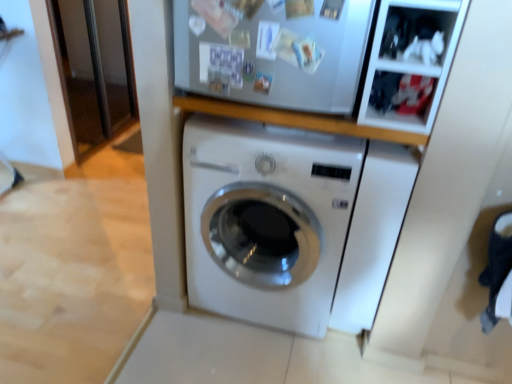
The width and height of the screenshot is (512, 384). What do you see at coordinates (373, 233) in the screenshot? I see `white glossy washing machine at center, which appears as the first washing machine when viewed from the right` at bounding box center [373, 233].

The height and width of the screenshot is (384, 512). In order to click on white glossy washing machine at center, which appears as the first washing machine when viewed from the right in this screenshot , I will do `click(373, 233)`.

Describe the element at coordinates (266, 220) in the screenshot. I see `white glossy washing machine at center, the 2th washing machine positioned from the right` at that location.

In order to face white glossy washing machine at center, which appears as the first washing machine when viewed from the left, should I rotate leftwards or rightwards?

Rotate right and turn 2.482 degrees.

This screenshot has height=384, width=512. In order to click on white glossy washing machine at center, which appears as the first washing machine when viewed from the left in this screenshot , I will do `click(266, 220)`.

The height and width of the screenshot is (384, 512). Find the location of `white glossy washing machine at center, acting as the 2th washing machine starting from the left`. white glossy washing machine at center, acting as the 2th washing machine starting from the left is located at coordinates (x=373, y=233).

Does white glossy washing machine at center, which appears as the first washing machine when viewed from the left, appear on the left side of white glossy washing machine at center, which appears as the first washing machine when viewed from the right?

Indeed, white glossy washing machine at center, which appears as the first washing machine when viewed from the left, is positioned on the left side of white glossy washing machine at center, which appears as the first washing machine when viewed from the right.

Relative to white glossy washing machine at center, which appears as the first washing machine when viewed from the right, is white glossy washing machine at center, which appears as the first washing machine when viewed from the left, in front or behind?

white glossy washing machine at center, which appears as the first washing machine when viewed from the left, is positioned closer to the viewer than white glossy washing machine at center, which appears as the first washing machine when viewed from the right.

Which point is more forward, (240, 171) or (354, 207)?

The point (354, 207) is more forward.

From the image's perspective, is white glossy washing machine at center, the 2th washing machine positioned from the right, located above white glossy washing machine at center, acting as the 2th washing machine starting from the left?

Yes, from the image's perspective, white glossy washing machine at center, the 2th washing machine positioned from the right, is over white glossy washing machine at center, acting as the 2th washing machine starting from the left.

Based on the photo, from a real-world perspective, is white glossy washing machine at center, which appears as the first washing machine when viewed from the left, positioned over white glossy washing machine at center, acting as the 2th washing machine starting from the left, based on gravity?

No, from a real-world perspective, white glossy washing machine at center, which appears as the first washing machine when viewed from the left, is not above white glossy washing machine at center, acting as the 2th washing machine starting from the left.

Between white glossy washing machine at center, which appears as the first washing machine when viewed from the left, and white glossy washing machine at center, which appears as the first washing machine when viewed from the right, which one has smaller width?

white glossy washing machine at center, which appears as the first washing machine when viewed from the right.

Who is taller, white glossy washing machine at center, the 2th washing machine positioned from the right, or white glossy washing machine at center, acting as the 2th washing machine starting from the left?

With more height is white glossy washing machine at center, the 2th washing machine positioned from the right.

Based on the photo, is white glossy washing machine at center, the 2th washing machine positioned from the right, bigger or smaller than white glossy washing machine at center, acting as the 2th washing machine starting from the left?

In the image, white glossy washing machine at center, the 2th washing machine positioned from the right, appears to be larger than white glossy washing machine at center, acting as the 2th washing machine starting from the left.

Choose the correct answer: Is white glossy washing machine at center, which appears as the first washing machine when viewed from the left, inside white glossy washing machine at center, acting as the 2th washing machine starting from the left, or outside it?

white glossy washing machine at center, which appears as the first washing machine when viewed from the left, cannot be found inside white glossy washing machine at center, acting as the 2th washing machine starting from the left.

Is white glossy washing machine at center, which appears as the first washing machine when viewed from the left, with white glossy washing machine at center, acting as the 2th washing machine starting from the left?

They are not placed beside each other.

Is white glossy washing machine at center, the 2th washing machine positioned from the right, turned away from white glossy washing machine at center, acting as the 2th washing machine starting from the left?

That's not correct — white glossy washing machine at center, the 2th washing machine positioned from the right, is not looking away from white glossy washing machine at center, acting as the 2th washing machine starting from the left.

How many degrees apart are the facing directions of white glossy washing machine at center, which appears as the first washing machine when viewed from the left, and white glossy washing machine at center, acting as the 2th washing machine starting from the left?

The angular difference between white glossy washing machine at center, which appears as the first washing machine when viewed from the left, and white glossy washing machine at center, acting as the 2th washing machine starting from the left, is 3.03 degrees.

How far apart are white glossy washing machine at center, which appears as the first washing machine when viewed from the left, and white glossy washing machine at center, which appears as the first washing machine when viewed from the right?

white glossy washing machine at center, which appears as the first washing machine when viewed from the left, is 25.74 centimeters from white glossy washing machine at center, which appears as the first washing machine when viewed from the right.

I want to click on washing machine on the right of white glossy washing machine at center, which appears as the first washing machine when viewed from the left, so click(373, 233).

Considering the relative positions of white glossy washing machine at center, acting as the 2th washing machine starting from the left, and white glossy washing machine at center, the 2th washing machine positioned from the right, in the image provided, is white glossy washing machine at center, acting as the 2th washing machine starting from the left, to the right of white glossy washing machine at center, the 2th washing machine positioned from the right, from the viewer's perspective?

Yes.

Which object is closer to the camera taking this photo, white glossy washing machine at center, which appears as the first washing machine when viewed from the right, or white glossy washing machine at center, the 2th washing machine positioned from the right?

white glossy washing machine at center, the 2th washing machine positioned from the right, is more forward.

Is point (376, 236) positioned in front of point (258, 302)?

Yes, point (376, 236) is in front of point (258, 302).

From the image's perspective, would you say white glossy washing machine at center, acting as the 2th washing machine starting from the left, is shown under white glossy washing machine at center, the 2th washing machine positioned from the right?

Yes, from the image's perspective, white glossy washing machine at center, acting as the 2th washing machine starting from the left, is beneath white glossy washing machine at center, the 2th washing machine positioned from the right.

From a real-world perspective, between white glossy washing machine at center, which appears as the first washing machine when viewed from the right, and white glossy washing machine at center, which appears as the first washing machine when viewed from the left, who is vertically lower?

From a 3D spatial view, white glossy washing machine at center, which appears as the first washing machine when viewed from the left, is below.

Is white glossy washing machine at center, which appears as the first washing machine when viewed from the right, wider than white glossy washing machine at center, the 2th washing machine positioned from the right?

No, white glossy washing machine at center, which appears as the first washing machine when viewed from the right, is not wider than white glossy washing machine at center, the 2th washing machine positioned from the right.

Considering the sizes of white glossy washing machine at center, acting as the 2th washing machine starting from the left, and white glossy washing machine at center, the 2th washing machine positioned from the right, in the image, is white glossy washing machine at center, acting as the 2th washing machine starting from the left, taller or shorter than white glossy washing machine at center, the 2th washing machine positioned from the right,?

white glossy washing machine at center, acting as the 2th washing machine starting from the left, is shorter than white glossy washing machine at center, the 2th washing machine positioned from the right.

Does white glossy washing machine at center, acting as the 2th washing machine starting from the left, have a larger size compared to white glossy washing machine at center, the 2th washing machine positioned from the right?

Actually, white glossy washing machine at center, acting as the 2th washing machine starting from the left, might be smaller than white glossy washing machine at center, the 2th washing machine positioned from the right.

Is white glossy washing machine at center, which appears as the first washing machine when viewed from the right, inside or outside of white glossy washing machine at center, the 2th washing machine positioned from the right?

white glossy washing machine at center, which appears as the first washing machine when viewed from the right, is outside white glossy washing machine at center, the 2th washing machine positioned from the right.

In the scene shown: Would you say white glossy washing machine at center, acting as the 2th washing machine starting from the left, is a long distance from white glossy washing machine at center, the 2th washing machine positioned from the right?

No.

Is white glossy washing machine at center, acting as the 2th washing machine starting from the left, facing towards white glossy washing machine at center, which appears as the first washing machine when viewed from the left?

No, white glossy washing machine at center, acting as the 2th washing machine starting from the left, is not facing towards white glossy washing machine at center, which appears as the first washing machine when viewed from the left.

You are a GUI agent. You are given a task and a screenshot of the screen. Output one action in this format:
    pyautogui.click(x=<x>, y=<y>)
    Task: Click on the washing machine on the right of white glossy washing machine at center, which appears as the first washing machine when viewed from the left
    This screenshot has height=384, width=512.
    Given the screenshot: What is the action you would take?
    pyautogui.click(x=373, y=233)

Locate an element on the screen. The width and height of the screenshot is (512, 384). washing machine that is above the white glossy washing machine at center, which appears as the first washing machine when viewed from the left (from a real-world perspective) is located at coordinates (373, 233).

Find the location of a particular element. This screenshot has height=384, width=512. washing machine that is in front of the white glossy washing machine at center, acting as the 2th washing machine starting from the left is located at coordinates (266, 220).